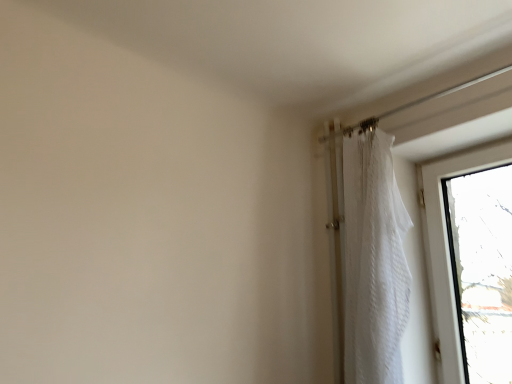
Question: Is transparent glass window at upper right not near white sheer curtain at upper right?

Choices:
 (A) no
 (B) yes

Answer: (A)

Question: Considering the relative sizes of transparent glass window at upper right and white sheer curtain at upper right in the image provided, is transparent glass window at upper right wider than white sheer curtain at upper right?

Choices:
 (A) no
 (B) yes

Answer: (A)

Question: Does transparent glass window at upper right come behind white sheer curtain at upper right?

Choices:
 (A) yes
 (B) no

Answer: (A)

Question: Considering the relative sizes of transparent glass window at upper right and white sheer curtain at upper right in the image provided, is transparent glass window at upper right bigger than white sheer curtain at upper right?

Choices:
 (A) yes
 (B) no

Answer: (B)

Question: Does transparent glass window at upper right have a smaller size compared to white sheer curtain at upper right?

Choices:
 (A) yes
 (B) no

Answer: (A)

Question: Could you tell me if transparent glass window at upper right is turned towards white sheer curtain at upper right?

Choices:
 (A) yes
 (B) no

Answer: (A)

Question: Is white sheer curtain at upper right shorter than transparent glass window at upper right?

Choices:
 (A) yes
 (B) no

Answer: (B)

Question: Is white sheer curtain at upper right wider than transparent glass window at upper right?

Choices:
 (A) yes
 (B) no

Answer: (A)

Question: Does white sheer curtain at upper right have a greater height compared to transparent glass window at upper right?

Choices:
 (A) yes
 (B) no

Answer: (A)

Question: Is white sheer curtain at upper right not close to transparent glass window at upper right?

Choices:
 (A) no
 (B) yes

Answer: (A)

Question: Is white sheer curtain at upper right thinner than transparent glass window at upper right?

Choices:
 (A) no
 (B) yes

Answer: (A)

Question: Is white sheer curtain at upper right in front of transparent glass window at upper right?

Choices:
 (A) no
 (B) yes

Answer: (B)

Question: Is transparent glass window at upper right wider or thinner than white sheer curtain at upper right?

Choices:
 (A) wide
 (B) thin

Answer: (B)